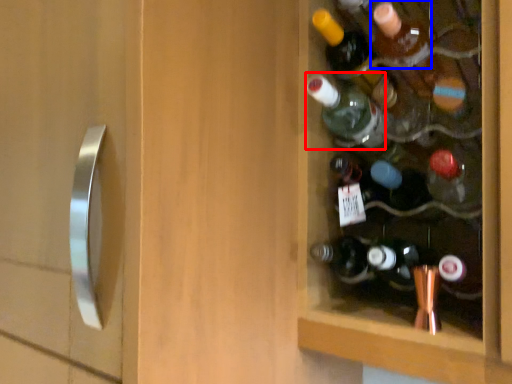
Question: Which of the following is the farthest to the observer, bottle (highlighted by a red box) or bottle (highlighted by a blue box)?

Choices:
 (A) bottle
 (B) bottle

Answer: (A)